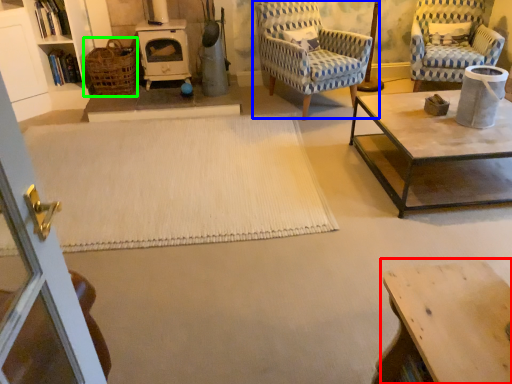
Question: Which object is the farthest from table (highlighted by a red box)? Choose among these: chair (highlighted by a blue box) or basket (highlighted by a green box).

Choices:
 (A) chair
 (B) basket

Answer: (B)